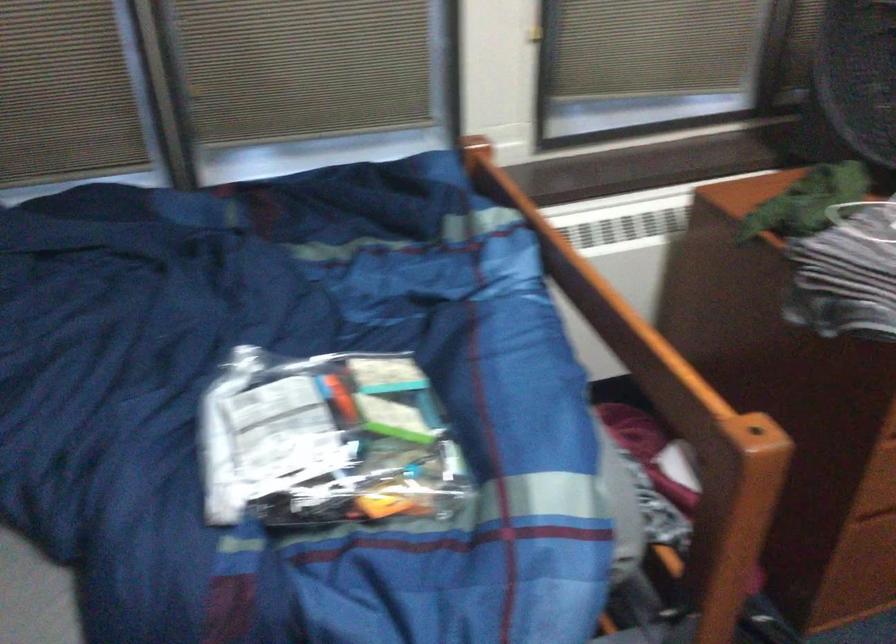
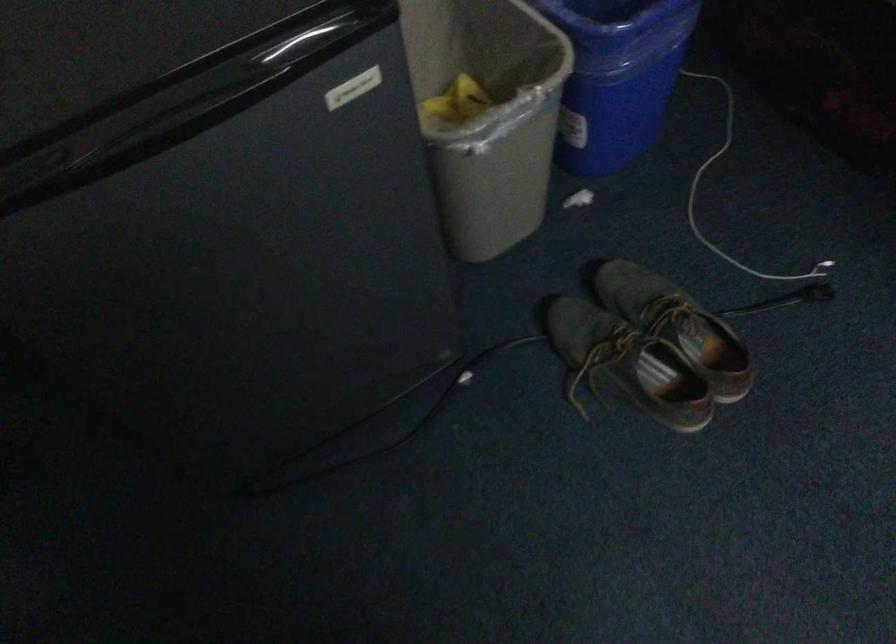
First-person continuous shooting, in which direction is the camera rotating?

The camera rotated toward left-down.